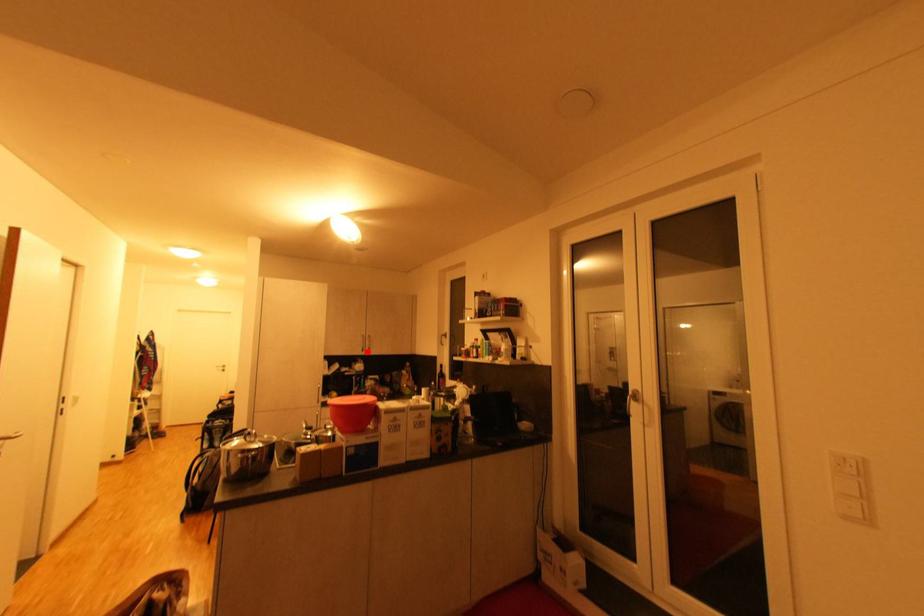
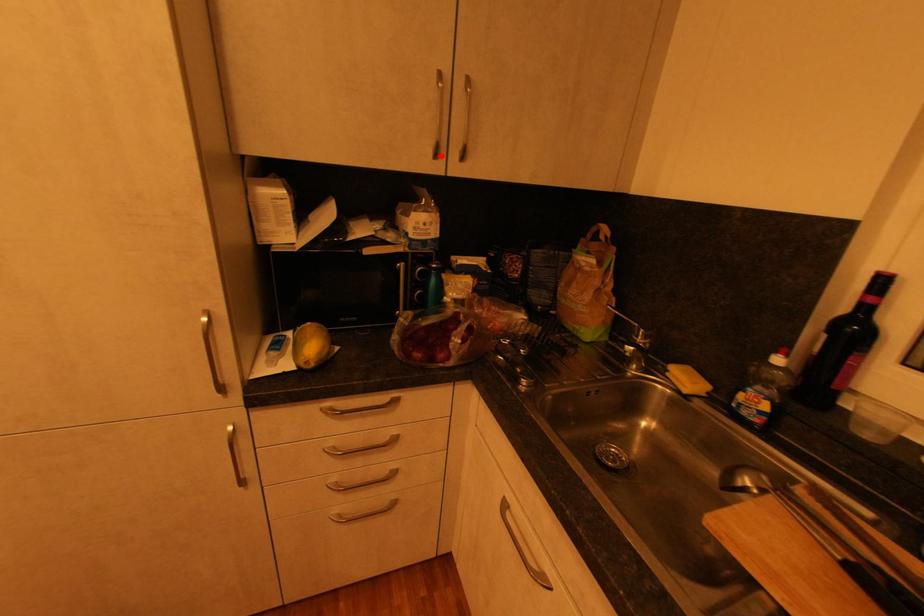
I am providing you with two images of the same scene from different viewpoints. A red point is marked on the first image and another point is marked on the second image. Is the marked point in image1 the same physical position as the marked point in image2?

Yes